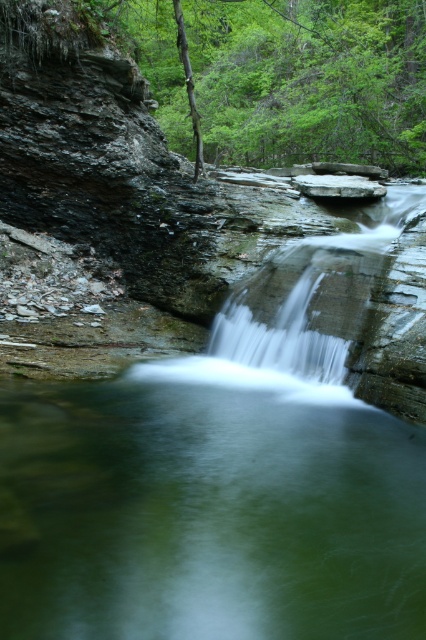
Question: Observing the image, what is the correct spatial positioning of green translucent water at center in reference to white smooth waterfall at center?

Choices:
 (A) below
 (B) above

Answer: (A)

Question: Is green translucent water at center to the right of white smooth waterfall at center from the viewer's perspective?

Choices:
 (A) no
 (B) yes

Answer: (A)

Question: Is the position of green translucent water at center less distant than that of white smooth waterfall at center?

Choices:
 (A) no
 (B) yes

Answer: (B)

Question: Which object is farther from the camera taking this photo?

Choices:
 (A) white smooth waterfall at center
 (B) green translucent water at center

Answer: (A)

Question: Which point is closer to the camera taking this photo?

Choices:
 (A) (345, 461)
 (B) (399, 374)

Answer: (A)

Question: Which object is farther from the camera taking this photo?

Choices:
 (A) green translucent water at center
 (B) white smooth waterfall at center

Answer: (B)